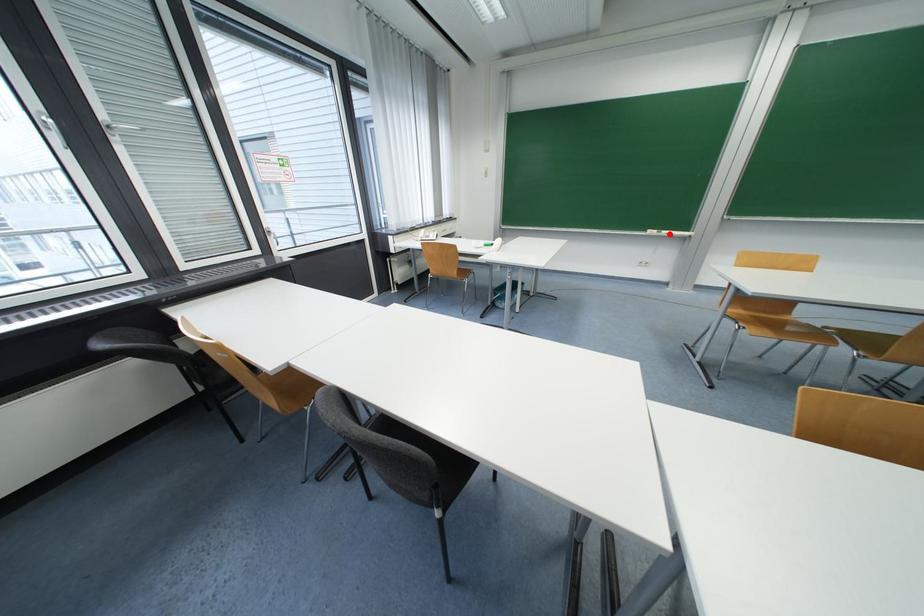
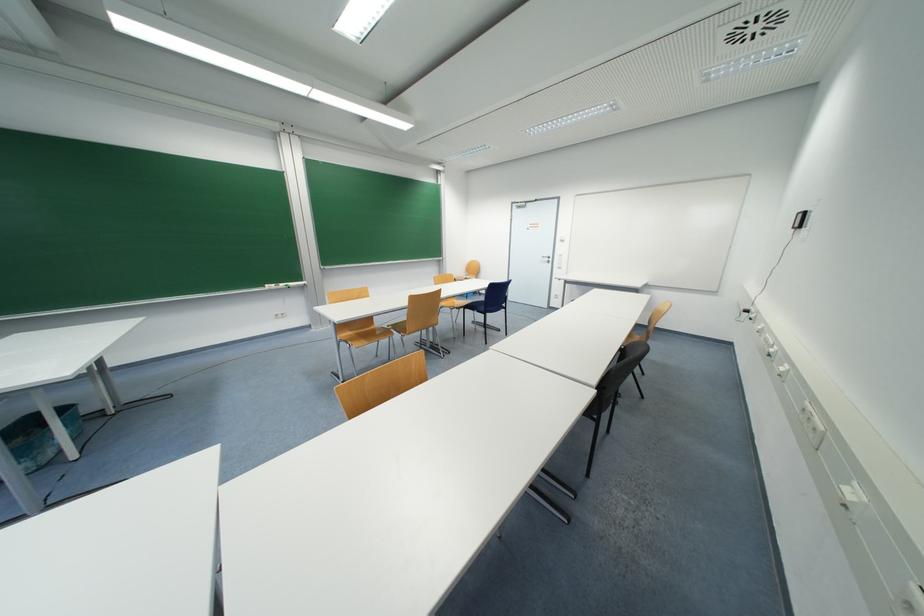
Question: I am providing you with two images of the same scene from different viewpoints. Image1 has a red point marked. In image2, the corresponding 3D location appears at what relative position? Reply with the corresponding letter.

Choices:
 (A) Closer
 (B) Farther

Answer: (A)